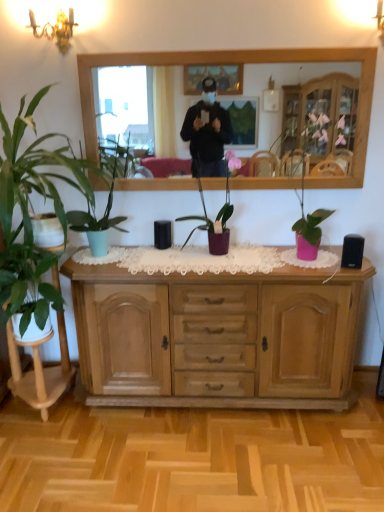
Question: Does light brown wood cabinet at center have a lesser width compared to green matte plant at left, the 2th houseplant positioned from the left?

Choices:
 (A) no
 (B) yes

Answer: (B)

Question: Considering the relative positions of light brown wood cabinet at center and green matte plant at left, marked as the third houseplant in a right-to-left arrangement, in the image provided, is light brown wood cabinet at center behind green matte plant at left, marked as the third houseplant in a right-to-left arrangement,?

Choices:
 (A) yes
 (B) no

Answer: (A)

Question: Would you say green matte plant at left, the 2th houseplant positioned from the left, is part of light brown wood cabinet at center's contents?

Choices:
 (A) yes
 (B) no

Answer: (B)

Question: Is light brown wood cabinet at center facing towards green matte plant at left, marked as the third houseplant in a right-to-left arrangement?

Choices:
 (A) no
 (B) yes

Answer: (A)

Question: Is light brown wood cabinet at center in front of green matte plant at left, the 2th houseplant positioned from the left?

Choices:
 (A) no
 (B) yes

Answer: (A)

Question: Looking at their shapes, would you say wooden mirror at upper center is wider or thinner than green matte plant at left, marked as the third houseplant in a right-to-left arrangement?

Choices:
 (A) thin
 (B) wide

Answer: (A)

Question: From a real-world perspective, relative to green matte plant at left, the 2th houseplant positioned from the left, is wooden mirror at upper center vertically above or below?

Choices:
 (A) below
 (B) above

Answer: (B)

Question: From their relative heights in the image, would you say wooden mirror at upper center is taller or shorter than green matte plant at left, marked as the third houseplant in a right-to-left arrangement?

Choices:
 (A) tall
 (B) short

Answer: (B)

Question: From the image's perspective, relative to green matte plant at left, the 2th houseplant positioned from the left, is wooden mirror at upper center above or below?

Choices:
 (A) below
 (B) above

Answer: (B)

Question: Is green matte plant at left, marked as the third houseplant in a right-to-left arrangement, taller or shorter than wooden mirror at upper center?

Choices:
 (A) tall
 (B) short

Answer: (A)

Question: From a real-world perspective, is green matte plant at left, marked as the third houseplant in a right-to-left arrangement, above or below wooden mirror at upper center?

Choices:
 (A) above
 (B) below

Answer: (B)

Question: Do you think green matte plant at left, the 2th houseplant positioned from the left, is within wooden mirror at upper center, or outside of it?

Choices:
 (A) outside
 (B) inside

Answer: (A)

Question: Relative to wooden mirror at upper center, is green matte plant at left, the 2th houseplant positioned from the left, in front or behind?

Choices:
 (A) front
 (B) behind

Answer: (A)

Question: Is point (322, 366) positioned closer to the camera than point (69, 212)?

Choices:
 (A) farther
 (B) closer

Answer: (A)

Question: In terms of height, does light brown wood cabinet at center look taller or shorter compared to green matte plant at left, marked as the 2th houseplant in a right-to-left arrangement?

Choices:
 (A) tall
 (B) short

Answer: (A)